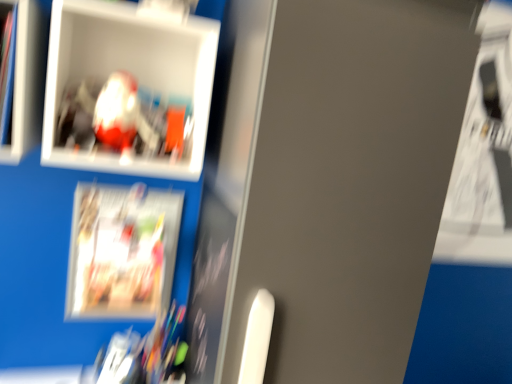
Question: From the image's perspective, would you say white plastic cabinet at upper left is positioned over matte plastic picture frame at upper left?

Choices:
 (A) no
 (B) yes

Answer: (B)

Question: Is white plastic cabinet at upper left thinner than matte plastic picture frame at upper left?

Choices:
 (A) yes
 (B) no

Answer: (A)

Question: Can you confirm if white plastic cabinet at upper left is shorter than matte plastic picture frame at upper left?

Choices:
 (A) yes
 (B) no

Answer: (A)

Question: Is white plastic cabinet at upper left looking in the opposite direction of matte plastic picture frame at upper left?

Choices:
 (A) yes
 (B) no

Answer: (B)

Question: Is white plastic cabinet at upper left positioned before matte plastic picture frame at upper left?

Choices:
 (A) no
 (B) yes

Answer: (B)

Question: Does white plastic cabinet at upper left have a greater height compared to matte plastic picture frame at upper left?

Choices:
 (A) yes
 (B) no

Answer: (B)

Question: From the image's perspective, is matte paper magazine at lower left below matte plastic picture frame at upper left?

Choices:
 (A) yes
 (B) no

Answer: (A)

Question: From a real-world perspective, is matte paper magazine at lower left physically above matte plastic picture frame at upper left?

Choices:
 (A) no
 (B) yes

Answer: (A)

Question: Is the position of matte paper magazine at lower left more distant than that of matte plastic picture frame at upper left?

Choices:
 (A) no
 (B) yes

Answer: (B)

Question: Does matte paper magazine at lower left appear on the right side of matte plastic picture frame at upper left?

Choices:
 (A) yes
 (B) no

Answer: (B)

Question: Is matte paper magazine at lower left outside of matte plastic picture frame at upper left?

Choices:
 (A) no
 (B) yes

Answer: (B)

Question: Would you say matte paper magazine at lower left is a long distance from matte plastic picture frame at upper left?

Choices:
 (A) yes
 (B) no

Answer: (B)

Question: Is white plastic cabinet at upper left inside matte plastic picture frame at upper left?

Choices:
 (A) yes
 (B) no

Answer: (B)